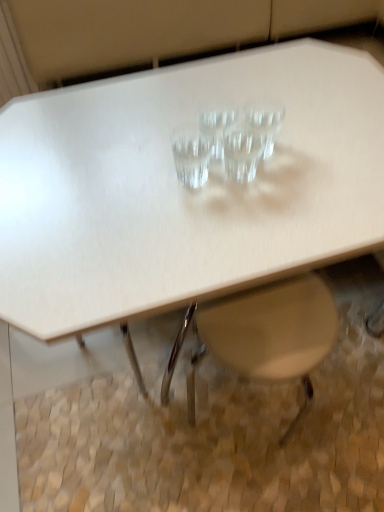
Locate an element on the screen. The image size is (384, 512). vacant area to the left of transparent glass martini glass at center, which is the second martini glass from left to right is located at coordinates (130, 154).